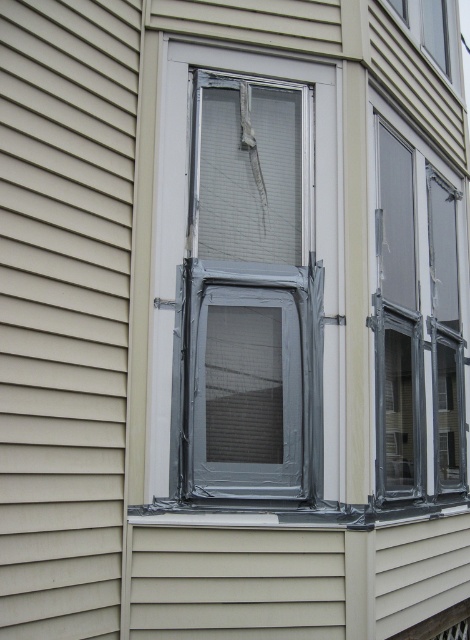
Question: Which of the following is the farthest from the observer?

Choices:
 (A) clear plastic window at center
 (B) metallic silver window frame at center
 (C) beige siding at center

Answer: (A)

Question: Can you confirm if beige siding at center is positioned to the right of clear plastic window at center?

Choices:
 (A) yes
 (B) no

Answer: (B)

Question: Among these points, which one is farthest from the camera?

Choices:
 (A) (120, 104)
 (B) (282, 390)

Answer: (B)

Question: Does beige siding at center appear over clear plastic window at center?

Choices:
 (A) no
 (B) yes

Answer: (B)

Question: Does metallic silver window frame at center have a larger size compared to clear plastic window at center?

Choices:
 (A) yes
 (B) no

Answer: (B)

Question: Which object appears closest to the camera in this image?

Choices:
 (A) beige siding at center
 (B) clear plastic window at center
 (C) metallic silver window frame at center

Answer: (A)